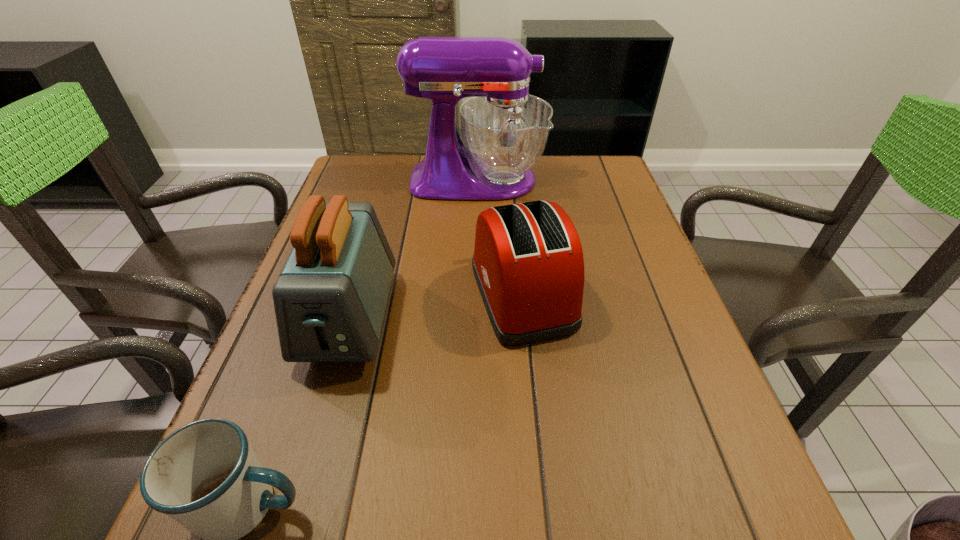
I want to click on object at the left edge, so click(330, 299).

I want to click on vacant space at the left edge, so click(x=311, y=411).

What are the coordinates of `vacant space at the right edge of the desktop` in the screenshot? It's located at pyautogui.click(x=621, y=232).

Identify the location of vacant space at the near left corner of the desktop. The height and width of the screenshot is (540, 960). (288, 528).

At what (x,y) coordinates should I click in order to perform the action: click on free location at the far right corner of the desktop. Please return your answer as a coordinate pair (x, y). Looking at the image, I should click on (604, 169).

Image resolution: width=960 pixels, height=540 pixels. Find the location of `vacant space that is in between the taller toaster and the tallest object`. vacant space that is in between the taller toaster and the tallest object is located at coordinates (414, 249).

You are a GUI agent. You are given a task and a screenshot of the screen. Output one action in this format:
    pyautogui.click(x=<x>, y=<y>)
    Task: Click on the free area in between the taller toaster and the shorter toaster
    The image size is (960, 540).
    Given the screenshot: What is the action you would take?
    pyautogui.click(x=436, y=306)

You are a GUI agent. You are given a task and a screenshot of the screen. Output one action in this format:
    pyautogui.click(x=<x>, y=<y>)
    Task: Click on the free space between the taller toaster and the farthest object
    
    Given the screenshot: What is the action you would take?
    pyautogui.click(x=414, y=249)

Where is `vacant space that's between the right toaster and the third shortest object`? Image resolution: width=960 pixels, height=540 pixels. vacant space that's between the right toaster and the third shortest object is located at coordinates (x=436, y=306).

You are a GUI agent. You are given a task and a screenshot of the screen. Output one action in this format:
    pyautogui.click(x=<x>, y=<y>)
    Task: Click on the unoccupied position between the third shortest object and the right toaster
    Image resolution: width=960 pixels, height=540 pixels.
    Given the screenshot: What is the action you would take?
    (436, 306)